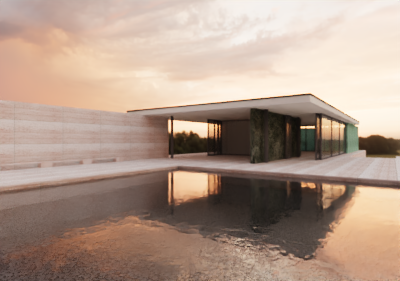
The image size is (400, 281). Identify the location of mirror. (212, 138), (215, 137), (325, 140), (334, 140), (341, 134).